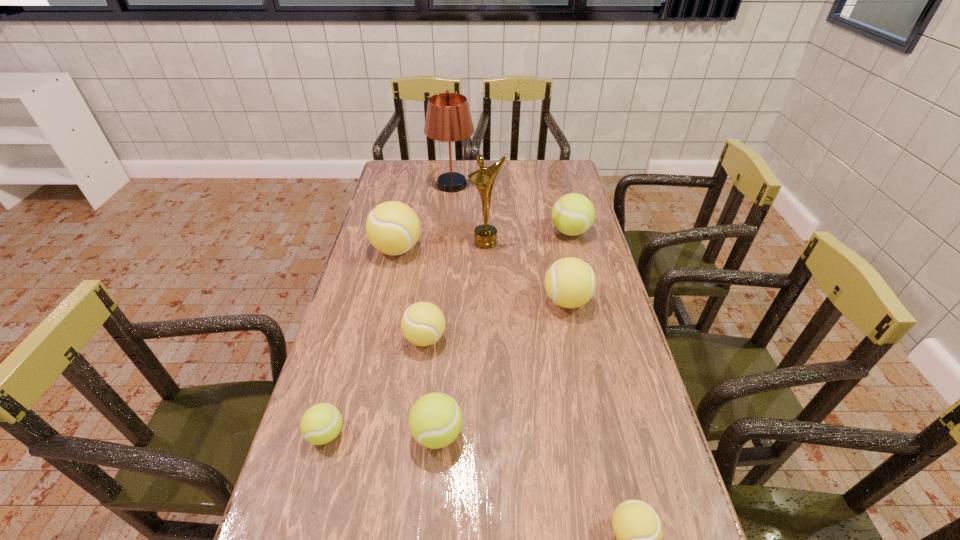
You are a GUI agent. You are given a task and a screenshot of the screen. Output one action in this format:
    pyautogui.click(x=<x>, y=<y>)
    Task: Click on the second biggest green tennis ball
    This screenshot has width=960, height=540.
    Given the screenshot: What is the action you would take?
    pyautogui.click(x=435, y=420)

Locate an element on the screen. The height and width of the screenshot is (540, 960). the smallest green tennis ball is located at coordinates [x=320, y=424].

The width and height of the screenshot is (960, 540). In order to click on vacant space located 0.240m on the front-facing side of the lampshade in this screenshot , I will do `click(538, 185)`.

You are a GUI agent. You are given a task and a screenshot of the screen. Output one action in this format:
    pyautogui.click(x=<x>, y=<y>)
    Task: Click on the vacant point located 0.400m on the front-facing side of the award
    
    Given the screenshot: What is the action you would take?
    pyautogui.click(x=488, y=338)

Locate an element on the screen. The height and width of the screenshot is (540, 960). free location located on the front of the biggest yellow tennis ball is located at coordinates (380, 322).

Locate an element on the screen. free space located 0.370m on the back of the rightmost green tennis ball is located at coordinates (555, 172).

The height and width of the screenshot is (540, 960). I want to click on vacant point located on the left of the fifth nearest object, so click(470, 301).

This screenshot has height=540, width=960. In order to click on free space located on the back of the third biggest yellow tennis ball in this screenshot , I will do `click(432, 279)`.

I want to click on free point located on the right of the second biggest green tennis ball, so click(588, 434).

This screenshot has width=960, height=540. I want to click on vacant space situated 0.080m on the front of the leftmost green tennis ball, so click(311, 489).